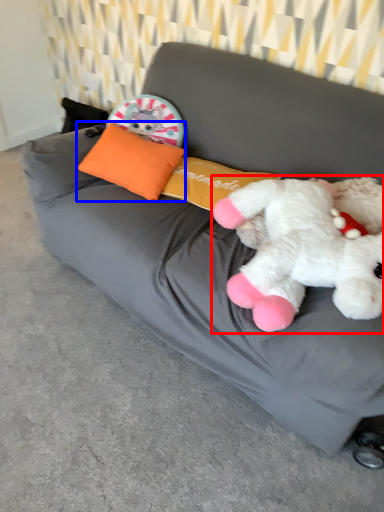
Question: Which point is closer to the camera, toy (highlighted by a red box) or pillow (highlighted by a blue box)?

Choices:
 (A) toy
 (B) pillow

Answer: (A)